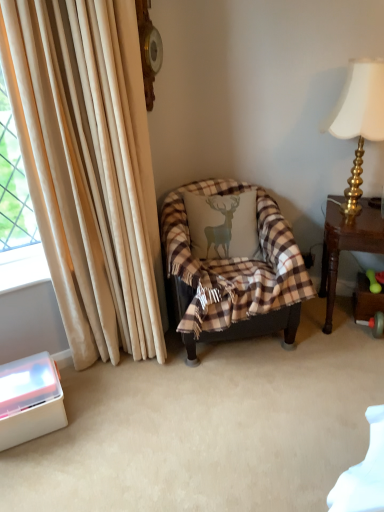
Question: Which direction should I rotate to look at plaid fabric pillow with deer design at center?

Choices:
 (A) left
 (B) right

Answer: (B)

Question: Does plaid fabric chair at center have a lesser width compared to gold metallic lampshade at upper right?

Choices:
 (A) yes
 (B) no

Answer: (B)

Question: From a real-world perspective, is plaid fabric chair at center physically below gold metallic lampshade at upper right?

Choices:
 (A) no
 (B) yes

Answer: (B)

Question: Is plaid fabric chair at center not close to gold metallic lampshade at upper right?

Choices:
 (A) yes
 (B) no

Answer: (B)

Question: Does plaid fabric chair at center appear on the right side of gold metallic lampshade at upper right?

Choices:
 (A) yes
 (B) no

Answer: (B)

Question: Considering the relative sizes of plaid fabric chair at center and gold metallic lampshade at upper right in the image provided, is plaid fabric chair at center wider than gold metallic lampshade at upper right?

Choices:
 (A) no
 (B) yes

Answer: (B)

Question: From a real-world perspective, is plaid fabric chair at center located higher than gold metallic lampshade at upper right?

Choices:
 (A) yes
 (B) no

Answer: (B)

Question: Would you say beige velvet curtain at left is part of white plastic container at lower left's contents?

Choices:
 (A) no
 (B) yes

Answer: (A)

Question: Are white plastic container at lower left and beige velvet curtain at left making contact?

Choices:
 (A) no
 (B) yes

Answer: (A)

Question: Is white plastic container at lower left far from beige velvet curtain at left?

Choices:
 (A) yes
 (B) no

Answer: (B)

Question: Can you confirm if white plastic container at lower left is shorter than beige velvet curtain at left?

Choices:
 (A) no
 (B) yes

Answer: (B)

Question: Is white plastic container at lower left at the right side of beige velvet curtain at left?

Choices:
 (A) no
 (B) yes

Answer: (A)

Question: From the image's perspective, is white plastic container at lower left below beige velvet curtain at left?

Choices:
 (A) yes
 (B) no

Answer: (A)

Question: Can you confirm if white plastic container at lower left is bigger than plaid fabric chair at center?

Choices:
 (A) yes
 (B) no

Answer: (B)